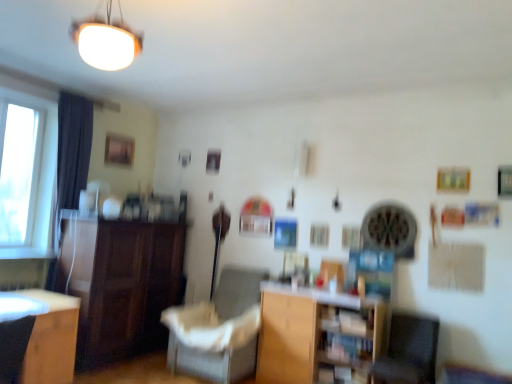
Question: From a real-world perspective, is dark gray fabric armchair at lower left over wooden at center?

Choices:
 (A) no
 (B) yes

Answer: (B)

Question: From the image's perspective, is dark gray fabric armchair at lower left above wooden at center?

Choices:
 (A) no
 (B) yes

Answer: (B)

Question: From the image's perspective, is dark gray fabric armchair at lower left beneath wooden at center?

Choices:
 (A) no
 (B) yes

Answer: (A)

Question: Is dark gray fabric armchair at lower left oriented away from wooden at center?

Choices:
 (A) no
 (B) yes

Answer: (A)

Question: Is dark gray fabric armchair at lower left not close to wooden at center?

Choices:
 (A) no
 (B) yes

Answer: (B)

Question: Visually, is gray fabric swivel chair at lower right positioned to the left or to the right of wooden at center?

Choices:
 (A) left
 (B) right

Answer: (B)

Question: Is gray fabric swivel chair at lower right situated inside wooden at center or outside?

Choices:
 (A) outside
 (B) inside

Answer: (A)

Question: Is point (391, 327) closer or farther from the camera than point (294, 365)?

Choices:
 (A) farther
 (B) closer

Answer: (B)

Question: Is gray fabric swivel chair at lower right in front of or behind wooden at center in the image?

Choices:
 (A) front
 (B) behind

Answer: (A)

Question: Is gray fabric swivel chair at lower right inside the boundaries of dark gray fabric armchair at lower left, or outside?

Choices:
 (A) outside
 (B) inside

Answer: (A)

Question: Based on their positions, is gray fabric swivel chair at lower right located to the left or right of dark gray fabric armchair at lower left?

Choices:
 (A) left
 (B) right

Answer: (B)

Question: Considering the positions of point (402, 344) and point (3, 380), is point (402, 344) closer or farther from the camera than point (3, 380)?

Choices:
 (A) closer
 (B) farther

Answer: (B)

Question: In terms of width, does gray fabric swivel chair at lower right look wider or thinner when compared to dark gray fabric armchair at lower left?

Choices:
 (A) thin
 (B) wide

Answer: (A)

Question: In terms of width, does wooden at center look wider or thinner when compared to dark wood cabinet at left?

Choices:
 (A) wide
 (B) thin

Answer: (B)

Question: Is point (268, 299) positioned closer to the camera than point (176, 253)?

Choices:
 (A) farther
 (B) closer

Answer: (B)